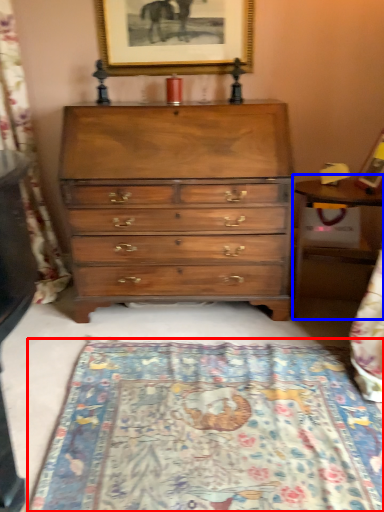
Question: Which point is further to the camera, mat (highlighted by a red box) or table (highlighted by a blue box)?

Choices:
 (A) mat
 (B) table

Answer: (B)